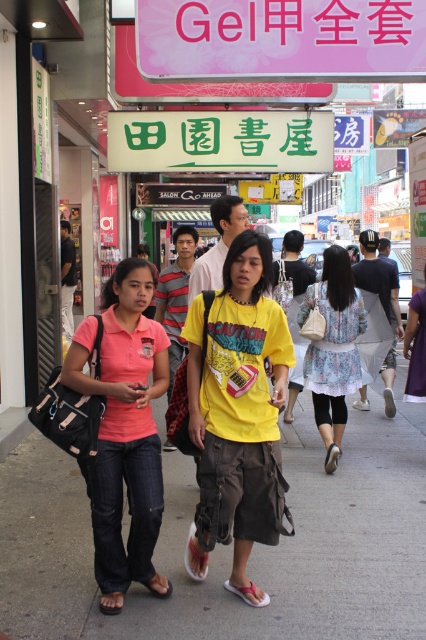
You are a delivery person standing on the gray concrete sidewalk at center and need to hand over a package to someone wearing the floral fabric dress at center. Can you reach them without moving from your current position?

The distance between the gray concrete sidewalk at center and the floral fabric dress at center is 2.10 meters. Since you are on the sidewalk, you would need to step forward to cover the 2.10 meter gap to reach the person in the floral fabric dress at center.

You are a delivery person standing on the sidewalk and need to cross the street to deliver a package. The street has a speed limit of 40 km per hour. Based on the distance between you and the gray concrete sidewalk at center, can you safely cross the street before any approaching cars arrive?

The gray concrete sidewalk at center is 3.01 meters away from you. Since the street has a speed limit of 40 km per hour, you should first check for oncoming traffic before attempting to cross. The distance alone does not guarantee safety without assessing traffic conditions.